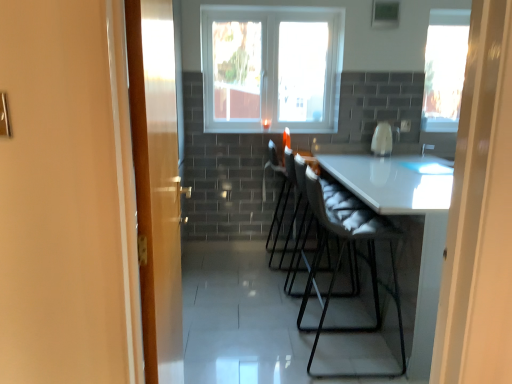
In order to face white fabric folding chair at center, should I rotate leftwards or rightwards?

To face it directly, rotate right by 6.909 degrees.

What is the approximate width of transparent glass window at upper right, the second window when ordered from left to right?

3.85 inches.

Find the location of `white glossy coffee machine at center`. white glossy coffee machine at center is located at coordinates (384, 139).

At what (x,y) coordinates should I click in order to perform the action: click on wooden door at left. Please return your answer as a coordinate pair (x, y). Looking at the image, I should click on click(x=156, y=184).

Find the location of `white fabric chair at center, acting as the 1th chair starting from the front`. white fabric chair at center, acting as the 1th chair starting from the front is located at coordinates (340, 262).

Considering the sizes of objects transparent glass window at center, marked as the first window in a left-to-right arrangement, and transparent glass window at upper right, the first window from the right, in the image provided, who is taller, transparent glass window at center, marked as the first window in a left-to-right arrangement, or transparent glass window at upper right, the first window from the right,?

With more height is transparent glass window at center, marked as the first window in a left-to-right arrangement.

Is transparent glass window at center, marked as the first window in a left-to-right arrangement, to the right of transparent glass window at upper right, the second window when ordered from left to right, from the viewer's perspective?

No.

Does transparent glass window at center, marked as the first window in a left-to-right arrangement, touch transparent glass window at upper right, the second window when ordered from left to right?

transparent glass window at center, marked as the first window in a left-to-right arrangement, and transparent glass window at upper right, the second window when ordered from left to right, are not in contact.

Would you say transparent glass window at center, the second window in the right-to-left sequence, is outside transparent glass window at upper right, the first window from the right?

Yes, transparent glass window at center, the second window in the right-to-left sequence, is outside of transparent glass window at upper right, the first window from the right.

From a real-world perspective, is transparent glass window at upper right, the first window from the right, positioned above or below white glossy coffee machine at center?

From a real-world perspective, transparent glass window at upper right, the first window from the right, is physically above white glossy coffee machine at center.

Does transparent glass window at upper right, the second window when ordered from left to right, have a lesser width compared to white glossy coffee machine at center?

Correct, the width of transparent glass window at upper right, the second window when ordered from left to right, is less than that of white glossy coffee machine at center.

Is transparent glass window at upper right, the first window from the right, far away from white glossy coffee machine at center?

That's not correct — transparent glass window at upper right, the first window from the right, is a little close to white glossy coffee machine at center.

Considering the relative sizes of transparent glass window at upper right, the second window when ordered from left to right, and white glossy coffee machine at center in the image provided, is transparent glass window at upper right, the second window when ordered from left to right, smaller than white glossy coffee machine at center?

Incorrect, transparent glass window at upper right, the second window when ordered from left to right, is not smaller in size than white glossy coffee machine at center.

Is white glossy coffee machine at center positioned with its back to wooden door at left?

No, wooden door at left is not at the back of white glossy coffee machine at center.

Looking at the image, does white glossy coffee machine at center seem bigger or smaller compared to wooden door at left?

white glossy coffee machine at center is smaller than wooden door at left.

Which of these two, white glossy coffee machine at center or wooden door at left, stands shorter?

white glossy coffee machine at center.

Are white fabric chair at center, which ranks as the 1th chair in back-to-front order, and white fabric chair at center, acting as the 1th chair starting from the front, located far from each other?

white fabric chair at center, which ranks as the 1th chair in back-to-front order, is actually quite close to white fabric chair at center, acting as the 1th chair starting from the front.

From the image's perspective, relative to white fabric chair at center, positioned as the second chair in back-to-front order, is white fabric chair at center, which ranks as the 1th chair in back-to-front order, above or below?

Based on their image positions, white fabric chair at center, which ranks as the 1th chair in back-to-front order, is located above white fabric chair at center, positioned as the second chair in back-to-front order.

Is white fabric chair at center, arranged as the second chair when viewed from the front, outside of white fabric chair at center, acting as the 1th chair starting from the front?

That's correct, white fabric chair at center, arranged as the second chair when viewed from the front, is outside of white fabric chair at center, acting as the 1th chair starting from the front.

How different are the orientations of white fabric chair at center, which ranks as the 1th chair in back-to-front order, and white fabric chair at center, positioned as the second chair in back-to-front order, in degrees?

white fabric chair at center, which ranks as the 1th chair in back-to-front order, and white fabric chair at center, positioned as the second chair in back-to-front order, are facing 0.000682 degrees away from each other.

Which of these two, wooden door at left or transparent glass window at upper right, the second window when ordered from left to right, is wider?

Wider between the two is transparent glass window at upper right, the second window when ordered from left to right.

Which of these two, wooden door at left or transparent glass window at upper right, the second window when ordered from left to right, is bigger?

→ With larger size is wooden door at left.

From a real-world perspective, which window is the 1st one above the wooden door at left? Please provide its 2D coordinates.

[(444, 69)]

Is point (170, 326) positioned behind point (462, 39)?

That is False.

Considering the sizes of transparent glass window at center, the second window in the right-to-left sequence, and white glossy coffee machine at center in the image, is transparent glass window at center, the second window in the right-to-left sequence, bigger or smaller than white glossy coffee machine at center?

transparent glass window at center, the second window in the right-to-left sequence, is bigger than white glossy coffee machine at center.

Does transparent glass window at center, marked as the first window in a left-to-right arrangement, contain white glossy coffee machine at center?

No, white glossy coffee machine at center is located outside of transparent glass window at center, marked as the first window in a left-to-right arrangement.

Can you tell me how much transparent glass window at center, marked as the first window in a left-to-right arrangement, and white glossy coffee machine at center differ in facing direction?

The angular difference between transparent glass window at center, marked as the first window in a left-to-right arrangement, and white glossy coffee machine at center is 0.00026 degrees.

Is transparent glass window at center, marked as the first window in a left-to-right arrangement, taller than white glossy coffee machine at center?

Correct, transparent glass window at center, marked as the first window in a left-to-right arrangement, is much taller as white glossy coffee machine at center.

Looking at this image, does white fabric chair at center, acting as the 1th chair starting from the front, appear on the left side of white fabric chair at center, which ranks as the 1th chair in back-to-front order?

In fact, white fabric chair at center, acting as the 1th chair starting from the front, is to the right of white fabric chair at center, which ranks as the 1th chair in back-to-front order.

Which object is closer to the camera, white fabric chair at center, positioned as the second chair in back-to-front order, or white fabric chair at center, arranged as the second chair when viewed from the front?

white fabric chair at center, positioned as the second chair in back-to-front order, is in front.

From a real-world perspective, is white fabric chair at center, acting as the 1th chair starting from the front, physically located above or below white fabric chair at center, which ranks as the 1th chair in back-to-front order?

In terms of real-world spatial position, white fabric chair at center, acting as the 1th chair starting from the front, is below white fabric chair at center, which ranks as the 1th chair in back-to-front order.

In the image, there is a transparent glass window at center, marked as the first window in a left-to-right arrangement. Where is `window below it (from a real-world perspective)`? This screenshot has height=384, width=512. window below it (from a real-world perspective) is located at coordinates (444, 69).

From a real-world perspective, which window is the 1st one above the white glossy coffee machine at center? Please provide its 2D coordinates.

[(444, 69)]

Consider the image. Which object lies nearer to the anchor point wooden door at left, white fabric chair at center, acting as the 1th chair starting from the front, or white fabric chair at center, arranged as the second chair when viewed from the front?

white fabric chair at center, acting as the 1th chair starting from the front.

Estimate the real-world distances between objects in this image. Which object is further from white fabric chair at center, positioned as the second chair in back-to-front order, transparent glass window at upper right, the second window when ordered from left to right, or white fabric folding chair at center?

Based on the image, transparent glass window at upper right, the second window when ordered from left to right, appears to be further to white fabric chair at center, positioned as the second chair in back-to-front order.

When comparing their distances from white fabric chair at center, which ranks as the 1th chair in back-to-front order, does white fabric folding chair at center or white fabric chair at center, positioned as the second chair in back-to-front order, seem closer?

Among the two, white fabric folding chair at center is located nearer to white fabric chair at center, which ranks as the 1th chair in back-to-front order.

Consider the image. Which object lies nearer to the anchor point white glossy coffee machine at center, white fabric folding chair at center or transparent glass window at center, marked as the first window in a left-to-right arrangement?

transparent glass window at center, marked as the first window in a left-to-right arrangement, is positioned closer to the anchor white glossy coffee machine at center.

Looking at the image, which one is located closer to wooden door at left, transparent glass window at center, marked as the first window in a left-to-right arrangement, or white fabric folding chair at center?

Based on the image, white fabric folding chair at center appears to be nearer to wooden door at left.

Estimate the real-world distances between objects in this image. Which object is closer to wooden door at left, white fabric folding chair at center or white fabric chair at center, which ranks as the 1th chair in back-to-front order?

white fabric folding chair at center is closer to wooden door at left.

Considering their positions, is wooden door at left positioned further to white fabric folding chair at center than transparent glass window at center, marked as the first window in a left-to-right arrangement?

transparent glass window at center, marked as the first window in a left-to-right arrangement, lies further to white fabric folding chair at center than the other object.

Looking at the image, which one is located further to wooden door at left, transparent glass window at center, marked as the first window in a left-to-right arrangement, or transparent glass window at upper right, the second window when ordered from left to right?

Based on the image, transparent glass window at upper right, the second window when ordered from left to right, appears to be further to wooden door at left.

The width and height of the screenshot is (512, 384). What are the coordinates of `appliance between white fabric chair at center, positioned as the second chair in back-to-front order, and transparent glass window at upper right, the second window when ordered from left to right, along the z-axis` in the screenshot? It's located at (384, 139).

This screenshot has height=384, width=512. I want to click on chair between white fabric chair at center, positioned as the second chair in back-to-front order, and transparent glass window at center, the second window in the right-to-left sequence, along the z-axis, so click(281, 188).

The width and height of the screenshot is (512, 384). What are the coordinates of `folding chair between white fabric chair at center, acting as the 1th chair starting from the front, and transparent glass window at upper right, the first window from the right, along the z-axis` in the screenshot? It's located at (339, 196).

You are a GUI agent. You are given a task and a screenshot of the screen. Output one action in this format:
    pyautogui.click(x=<x>, y=<y>)
    Task: Click on the appliance situated between white fabric chair at center, arranged as the second chair when viewed from the front, and transparent glass window at upper right, the first window from the right, from left to right
    The image size is (512, 384).
    Given the screenshot: What is the action you would take?
    pyautogui.click(x=384, y=139)